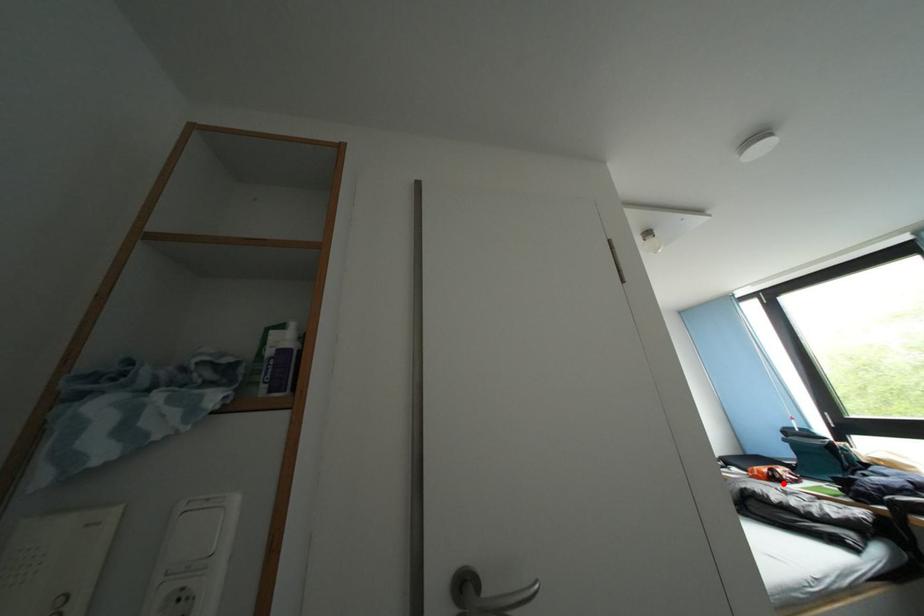
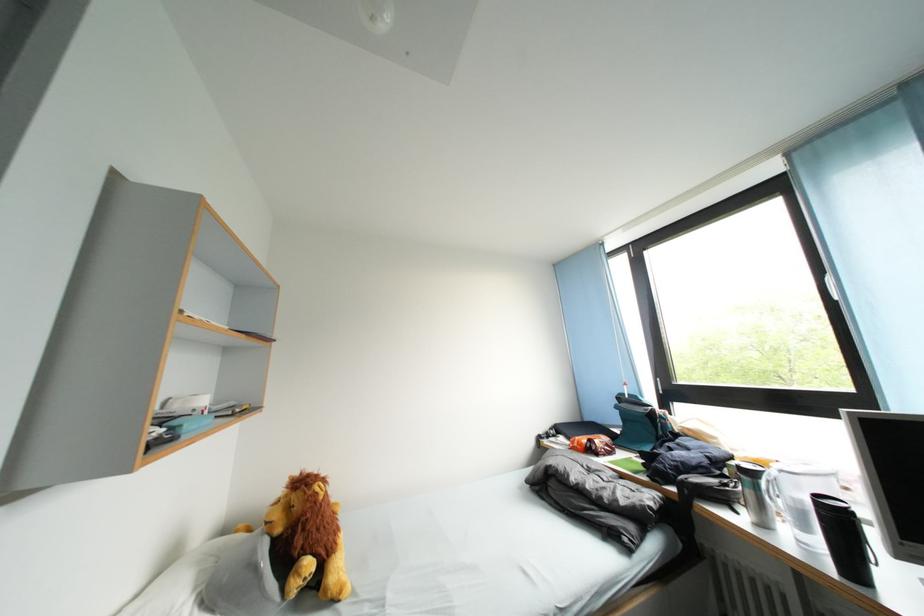
In the second image, find the point that corresponds to the highlighted location in the first image.

(600, 455)